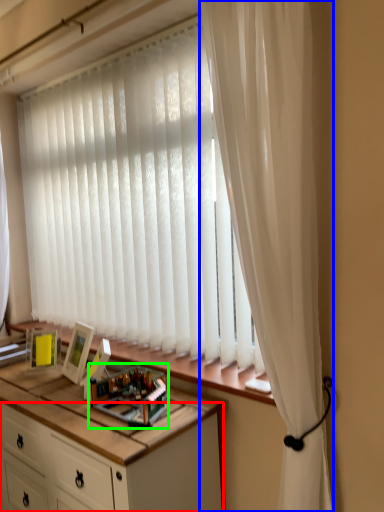
Question: Estimate the real-world distances between objects in this image. Which object is farther from cabinetry (highlighted by a red box), curtain (highlighted by a blue box) or toy (highlighted by a green box)?

Choices:
 (A) curtain
 (B) toy

Answer: (A)